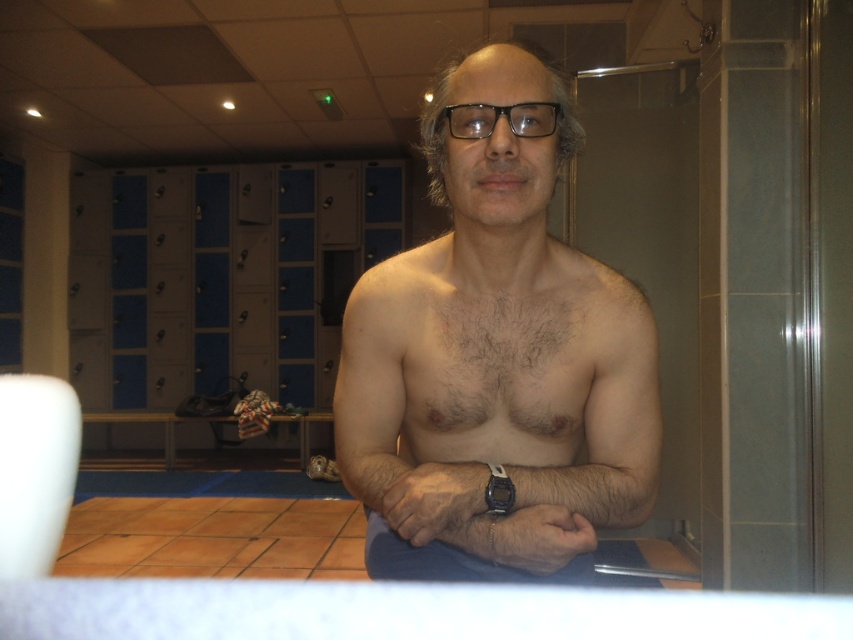
Question: Is hairless skin at center in front of brown hairy chest at center?

Choices:
 (A) no
 (B) yes

Answer: (B)

Question: Which of these objects is positioned closest to the brown hairy chest at center?

Choices:
 (A) black plastic glasses at center
 (B) hairy skin at center
 (C) hairless skin at center

Answer: (B)

Question: Can you confirm if hairy skin at center is positioned to the right of black plastic glasses at center?

Choices:
 (A) yes
 (B) no

Answer: (A)

Question: Estimate the real-world distances between objects in this image. Which object is closer to the black plastic glasses at center?

Choices:
 (A) hairy skin at center
 (B) hairless skin at center
 (C) brown hairy chest at center

Answer: (C)

Question: Which of the following is the farthest from the observer?

Choices:
 (A) brown hairy chest at center
 (B) hairless skin at center
 (C) black plastic glasses at center
 (D) hairy skin at center

Answer: (A)

Question: Does hairless skin at center come in front of brown hairy chest at center?

Choices:
 (A) no
 (B) yes

Answer: (B)